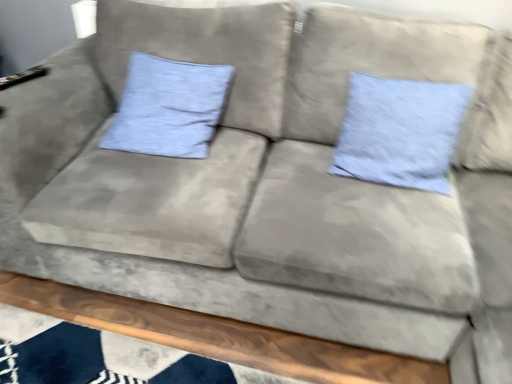
What do you see at coordinates (400, 132) in the screenshot? Image resolution: width=512 pixels, height=384 pixels. I see `light blue fabric pillow at center, which ranks as the 1th pillow in right-to-left order` at bounding box center [400, 132].

Where is `light blue fabric pillow at center, which ranks as the 1th pillow in right-to-left order`? The height and width of the screenshot is (384, 512). light blue fabric pillow at center, which ranks as the 1th pillow in right-to-left order is located at coordinates (400, 132).

Describe the element at coordinates (169, 107) in the screenshot. I see `light blue fabric pillow at upper left, placed as the 1th pillow when sorted from left to right` at that location.

Locate an element on the screen. light blue fabric pillow at upper left, the 2th pillow when ordered from right to left is located at coordinates (169, 107).

Locate an element on the screen. The image size is (512, 384). light blue fabric pillow at center, which ranks as the 1th pillow in right-to-left order is located at coordinates (400, 132).

Between light blue fabric pillow at upper left, placed as the 1th pillow when sorted from left to right, and light blue fabric pillow at center, which ranks as the 1th pillow in right-to-left order, which one appears on the left side from the viewer's perspective?

light blue fabric pillow at upper left, placed as the 1th pillow when sorted from left to right, is more to the left.

Is light blue fabric pillow at upper left, placed as the 1th pillow when sorted from left to right, closer to the viewer compared to light blue fabric pillow at center, which ranks as the 1th pillow in right-to-left order?

No, the depth of light blue fabric pillow at upper left, placed as the 1th pillow when sorted from left to right, is greater than that of light blue fabric pillow at center, which ranks as the 1th pillow in right-to-left order.

Is point (123, 101) farther from viewer compared to point (346, 160)?

That is True.

Consider the image. From the image's perspective, is light blue fabric pillow at upper left, the 2th pillow when ordered from right to left, located beneath light blue fabric pillow at center, the second pillow when ordered from left to right?

Actually, light blue fabric pillow at upper left, the 2th pillow when ordered from right to left, appears above light blue fabric pillow at center, the second pillow when ordered from left to right, in the image.

From a real-world perspective, which is physically above, light blue fabric pillow at upper left, placed as the 1th pillow when sorted from left to right, or light blue fabric pillow at center, which ranks as the 1th pillow in right-to-left order?

light blue fabric pillow at center, which ranks as the 1th pillow in right-to-left order.

Considering the sizes of objects light blue fabric pillow at upper left, placed as the 1th pillow when sorted from left to right, and light blue fabric pillow at center, the second pillow when ordered from left to right, in the image provided, who is wider, light blue fabric pillow at upper left, placed as the 1th pillow when sorted from left to right, or light blue fabric pillow at center, the second pillow when ordered from left to right,?

light blue fabric pillow at upper left, placed as the 1th pillow when sorted from left to right, is wider.

Which of these two, light blue fabric pillow at upper left, placed as the 1th pillow when sorted from left to right, or light blue fabric pillow at center, the second pillow when ordered from left to right, stands shorter?

light blue fabric pillow at upper left, placed as the 1th pillow when sorted from left to right.

Is light blue fabric pillow at upper left, the 2th pillow when ordered from right to left, bigger than light blue fabric pillow at center, the second pillow when ordered from left to right?

Yes.

Is light blue fabric pillow at upper left, placed as the 1th pillow when sorted from left to right, situated inside light blue fabric pillow at center, the second pillow when ordered from left to right, or outside?

light blue fabric pillow at upper left, placed as the 1th pillow when sorted from left to right, lies outside light blue fabric pillow at center, the second pillow when ordered from left to right.

Are light blue fabric pillow at upper left, the 2th pillow when ordered from right to left, and light blue fabric pillow at center, which ranks as the 1th pillow in right-to-left order, located far from each other?

They are positioned close to each other.

Is light blue fabric pillow at upper left, placed as the 1th pillow when sorted from left to right, turned away from light blue fabric pillow at center, which ranks as the 1th pillow in right-to-left order?

No, light blue fabric pillow at upper left, placed as the 1th pillow when sorted from left to right, is not facing away from light blue fabric pillow at center, which ranks as the 1th pillow in right-to-left order.

Could you measure the distance between light blue fabric pillow at upper left, placed as the 1th pillow when sorted from left to right, and light blue fabric pillow at center, which ranks as the 1th pillow in right-to-left order?

A distance of 25.30 inches exists between light blue fabric pillow at upper left, placed as the 1th pillow when sorted from left to right, and light blue fabric pillow at center, which ranks as the 1th pillow in right-to-left order.

Locate an element on the screen. Image resolution: width=512 pixels, height=384 pixels. pillow above the light blue fabric pillow at upper left, placed as the 1th pillow when sorted from left to right (from a real-world perspective) is located at coordinates [400, 132].

Between light blue fabric pillow at center, the second pillow when ordered from left to right, and light blue fabric pillow at upper left, the 2th pillow when ordered from right to left, which one appears on the left side from the viewer's perspective?

light blue fabric pillow at upper left, the 2th pillow when ordered from right to left, is more to the left.

Is light blue fabric pillow at center, which ranks as the 1th pillow in right-to-left order, in front of light blue fabric pillow at upper left, placed as the 1th pillow when sorted from left to right?

Yes, it is in front of light blue fabric pillow at upper left, placed as the 1th pillow when sorted from left to right.

Does point (350, 125) come closer to viewer compared to point (190, 140)?

Yes, it is in front of point (190, 140).

From the image's perspective, is light blue fabric pillow at center, the second pillow when ordered from left to right, positioned above or below light blue fabric pillow at upper left, the 2th pillow when ordered from right to left?

Based on their image positions, light blue fabric pillow at center, the second pillow when ordered from left to right, is located beneath light blue fabric pillow at upper left, the 2th pillow when ordered from right to left.

From a real-world perspective, relative to light blue fabric pillow at upper left, placed as the 1th pillow when sorted from left to right, is light blue fabric pillow at center, which ranks as the 1th pillow in right-to-left order, vertically above or below?

In terms of real-world spatial position, light blue fabric pillow at center, which ranks as the 1th pillow in right-to-left order, is above light blue fabric pillow at upper left, placed as the 1th pillow when sorted from left to right.

Considering the relative sizes of light blue fabric pillow at center, which ranks as the 1th pillow in right-to-left order, and light blue fabric pillow at upper left, the 2th pillow when ordered from right to left, in the image provided, is light blue fabric pillow at center, which ranks as the 1th pillow in right-to-left order, wider than light blue fabric pillow at upper left, the 2th pillow when ordered from right to left,?

No.

Is light blue fabric pillow at center, which ranks as the 1th pillow in right-to-left order, shorter than light blue fabric pillow at upper left, the 2th pillow when ordered from right to left?

No.

Is light blue fabric pillow at center, the second pillow when ordered from left to right, bigger than light blue fabric pillow at upper left, the 2th pillow when ordered from right to left?

Incorrect, light blue fabric pillow at center, the second pillow when ordered from left to right, is not larger than light blue fabric pillow at upper left, the 2th pillow when ordered from right to left.

Can light blue fabric pillow at upper left, placed as the 1th pillow when sorted from left to right, be found inside light blue fabric pillow at center, which ranks as the 1th pillow in right-to-left order?

Definitely not — light blue fabric pillow at upper left, placed as the 1th pillow when sorted from left to right, is not inside light blue fabric pillow at center, which ranks as the 1th pillow in right-to-left order.

Is light blue fabric pillow at center, the second pillow when ordered from left to right, directly adjacent to light blue fabric pillow at upper left, placed as the 1th pillow when sorted from left to right?

No.

Could you tell me if light blue fabric pillow at center, the second pillow when ordered from left to right, is facing light blue fabric pillow at upper left, placed as the 1th pillow when sorted from left to right?

No, light blue fabric pillow at center, the second pillow when ordered from left to right, does not turn towards light blue fabric pillow at upper left, placed as the 1th pillow when sorted from left to right.

Can you tell me how much light blue fabric pillow at center, which ranks as the 1th pillow in right-to-left order, and light blue fabric pillow at upper left, the 2th pillow when ordered from right to left, differ in facing direction?

The angle between the facing direction of light blue fabric pillow at center, which ranks as the 1th pillow in right-to-left order, and the facing direction of light blue fabric pillow at upper left, the 2th pillow when ordered from right to left, is 0.381 degrees.

At what (x,y) coordinates should I click in order to perform the action: click on pillow positioned vertically above the light blue fabric pillow at upper left, placed as the 1th pillow when sorted from left to right (from a real-world perspective). Please return your answer as a coordinate pair (x, y). This screenshot has height=384, width=512. Looking at the image, I should click on (400, 132).

Where is `pillow above the light blue fabric pillow at center, which ranks as the 1th pillow in right-to-left order (from the image's perspective)`? The height and width of the screenshot is (384, 512). pillow above the light blue fabric pillow at center, which ranks as the 1th pillow in right-to-left order (from the image's perspective) is located at coordinates (169, 107).

Image resolution: width=512 pixels, height=384 pixels. What are the coordinates of `pillow that appears behind the light blue fabric pillow at center, the second pillow when ordered from left to right` in the screenshot? It's located at (169, 107).